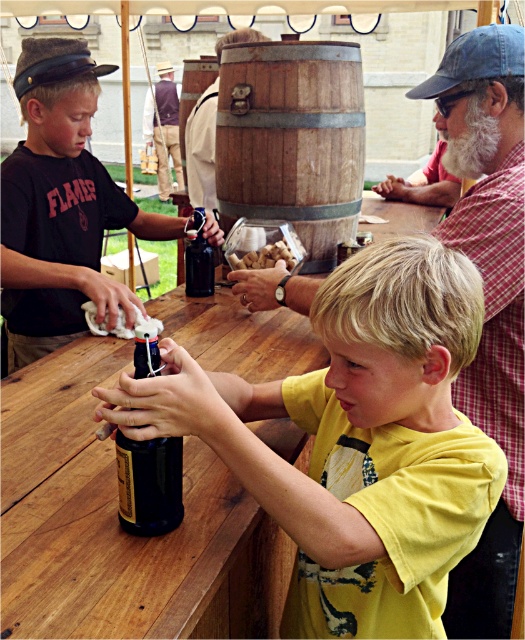
Which is more to the left, yellow matte shirt at center or checkered shirt at upper right?

yellow matte shirt at center

Is point (417, 484) positioned in front of point (512, 344)?

That is True.

Identify the location of yellow matte shirt at center. The width and height of the screenshot is (525, 640). (354, 442).

Is wooden table at center closer to camera compared to dark blue glass bottle at center?

Yes, wooden table at center is in front of dark blue glass bottle at center.

Between wooden table at center and dark blue glass bottle at center, which one appears on the left side from the viewer's perspective?

wooden table at center

Between point (156, 561) and point (124, 444), which one is positioned in front?

Point (156, 561)

This screenshot has height=640, width=525. I want to click on wooden table at center, so click(x=119, y=525).

Does matte black shirt at left appear over wooden barrel at center?

No, matte black shirt at left is not above wooden barrel at center.

Which of these two, matte black shirt at left or wooden barrel at center, stands shorter?

wooden barrel at center is shorter.

The image size is (525, 640). What are the coordinates of `matte black shirt at left` in the screenshot? It's located at (60, 205).